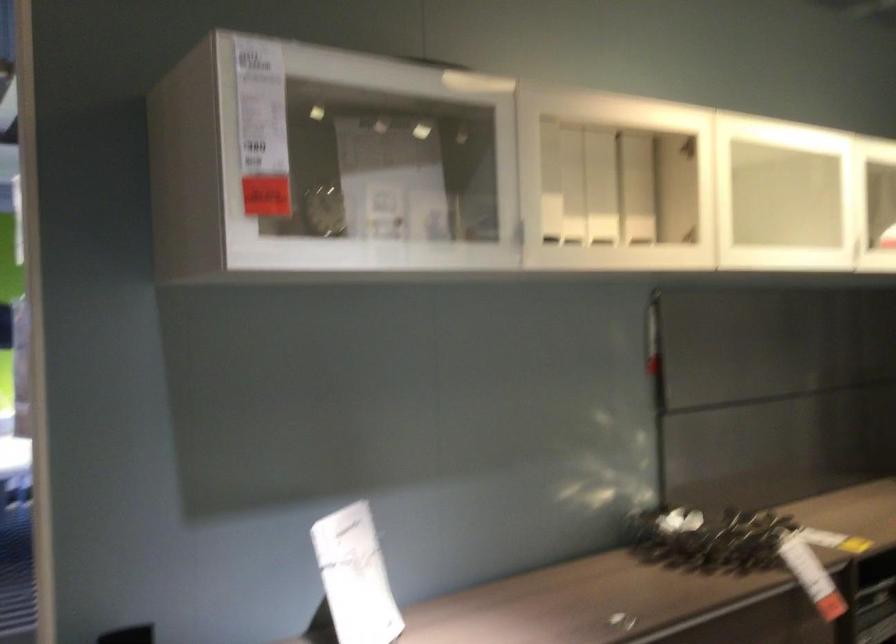
Describe the element at coordinates (519, 232) in the screenshot. The width and height of the screenshot is (896, 644). I see `the silver cabinet handle` at that location.